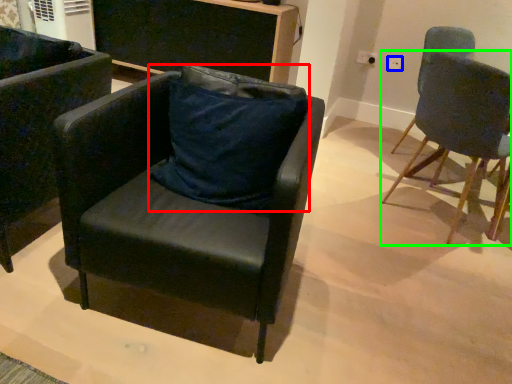
Question: Considering the real-world distances, which object is farthest from pillow (highlighted by a red box)? power outlet (highlighted by a blue box) or chair (highlighted by a green box)?

Choices:
 (A) power outlet
 (B) chair

Answer: (A)